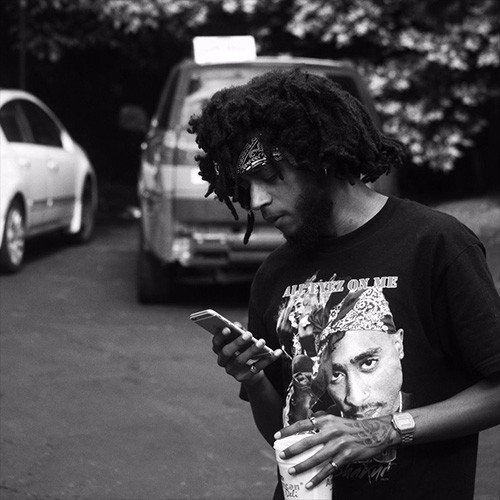
I want to click on cup, so click(296, 487).